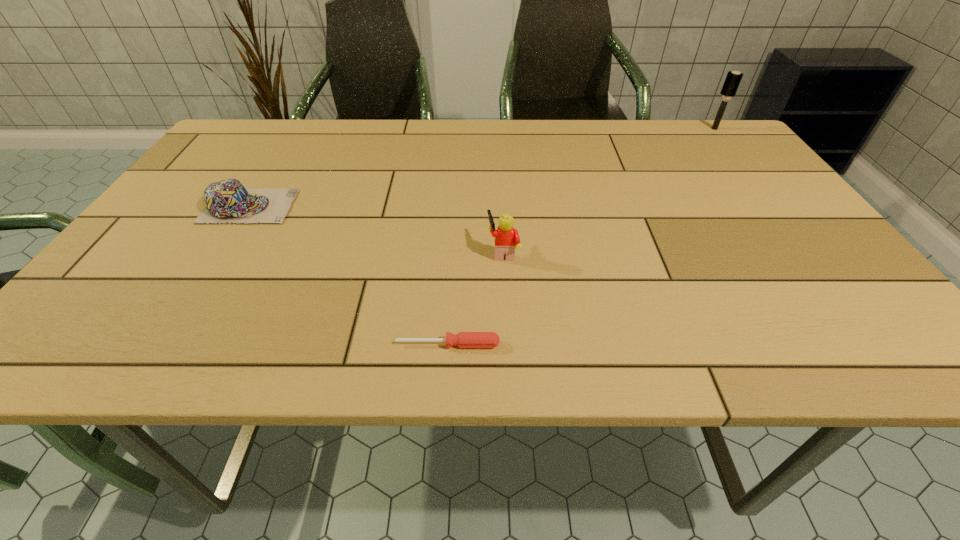
This screenshot has width=960, height=540. In order to click on free location that satisfies the following two spatial constraints: 1. in front of the Lego with the accessory visible; 2. on the front side of the nearest object in this screenshot , I will do `click(508, 345)`.

Image resolution: width=960 pixels, height=540 pixels. Identify the location of vacant point that satisfies the following two spatial constraints: 1. on the front, side, and top of the cap; 2. on the left side of the shortest object. (163, 345).